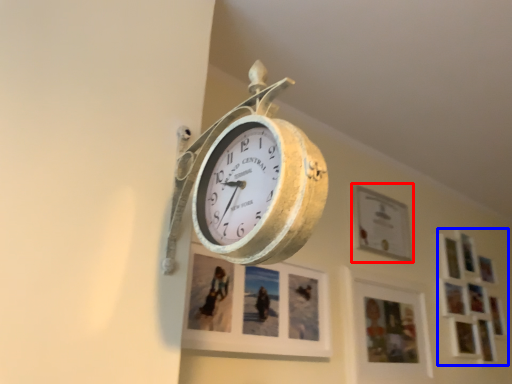
Question: Which of the following is the farthest to the observer, picture frame (highlighted by a red box) or picture frame (highlighted by a blue box)?

Choices:
 (A) picture frame
 (B) picture frame

Answer: (B)